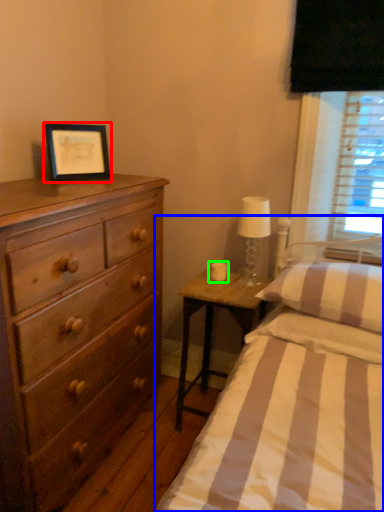
Question: Based on their relative distances, which object is farther from picture frame (highlighted by a red box)? Choose from bed (highlighted by a blue box) and candle holder (highlighted by a green box).

Choices:
 (A) bed
 (B) candle holder

Answer: (A)